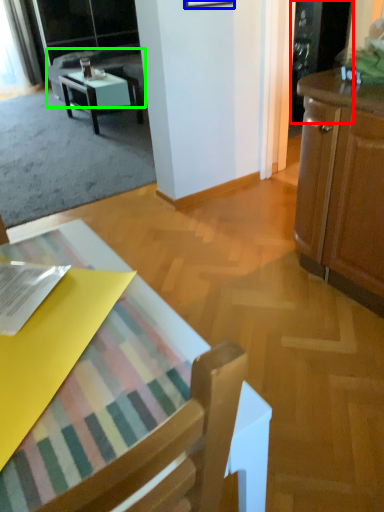
Question: Which object is positioned closest to screen door (highlighted by a red box)? Select from picture frame (highlighted by a blue box) and couch (highlighted by a green box).

Choices:
 (A) picture frame
 (B) couch

Answer: (A)